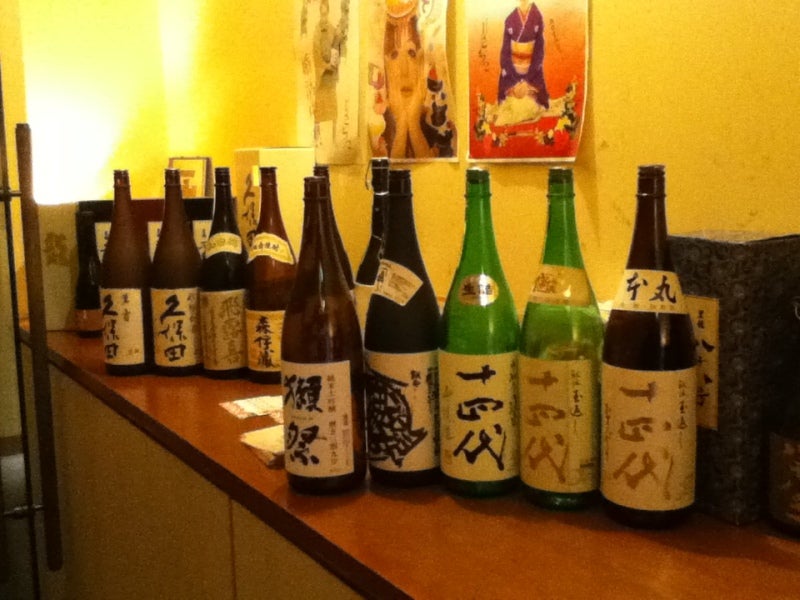
Locate an element on the screen. The image size is (800, 600). black and white poster on the left is located at coordinates (338, 85).